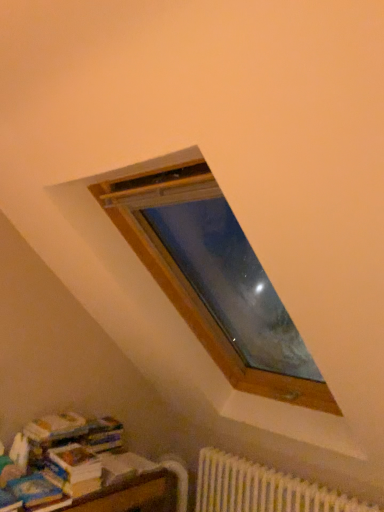
Question: Does blue matte paperback book at lower left have a lesser height compared to white paper book at lower left?

Choices:
 (A) yes
 (B) no

Answer: (A)

Question: From the image's perspective, is blue matte paperback book at lower left located above white paper book at lower left?

Choices:
 (A) no
 (B) yes

Answer: (A)

Question: From a real-world perspective, is blue matte paperback book at lower left positioned under white paper book at lower left based on gravity?

Choices:
 (A) no
 (B) yes

Answer: (B)

Question: Does blue matte paperback book at lower left have a larger size compared to white paper book at lower left?

Choices:
 (A) no
 (B) yes

Answer: (A)

Question: Is blue matte paperback book at lower left oriented towards white paper book at lower left?

Choices:
 (A) yes
 (B) no

Answer: (B)

Question: Considering the positions of point (26, 478) and point (230, 454), is point (26, 478) closer or farther from the camera than point (230, 454)?

Choices:
 (A) closer
 (B) farther

Answer: (A)

Question: Would you say blue matte paperback book at lower left is to the left or to the right of white plastic radiator at lower right in the picture?

Choices:
 (A) left
 (B) right

Answer: (A)

Question: Relative to white plastic radiator at lower right, is blue matte paperback book at lower left in front or behind?

Choices:
 (A) behind
 (B) front

Answer: (B)

Question: From a real-world perspective, relative to white plastic radiator at lower right, is blue matte paperback book at lower left vertically above or below?

Choices:
 (A) below
 (B) above

Answer: (B)

Question: Looking at their shapes, would you say white plastic radiator at lower right is wider or thinner than blue matte paperback book at lower left?

Choices:
 (A) wide
 (B) thin

Answer: (B)

Question: From the image's perspective, is white plastic radiator at lower right located above or below blue matte paperback book at lower left?

Choices:
 (A) above
 (B) below

Answer: (B)

Question: Considering the positions of white plastic radiator at lower right and blue matte paperback book at lower left in the image, is white plastic radiator at lower right bigger or smaller than blue matte paperback book at lower left?

Choices:
 (A) big
 (B) small

Answer: (A)

Question: Considering the positions of point (244, 493) and point (39, 474), is point (244, 493) closer or farther from the camera than point (39, 474)?

Choices:
 (A) closer
 (B) farther

Answer: (B)

Question: Based on their positions, is blue matte paperback book at lower left located to the left or right of white paper book at lower left?

Choices:
 (A) right
 (B) left

Answer: (B)

Question: Based on their sizes in the image, would you say blue matte paperback book at lower left is bigger or smaller than white paper book at lower left?

Choices:
 (A) small
 (B) big

Answer: (A)